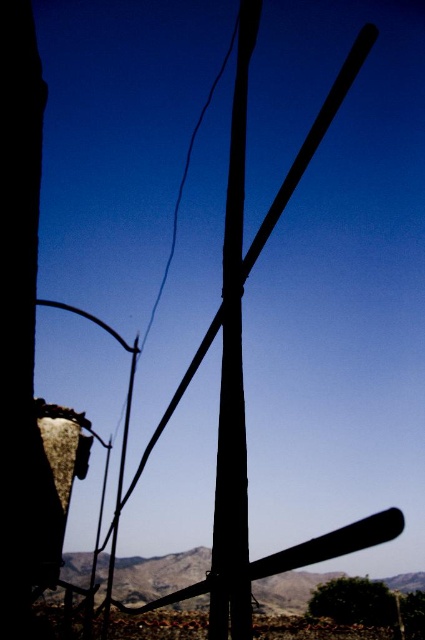
Question: Does smooth wood pole at center have a lesser width compared to green leafy tree at lower center?

Choices:
 (A) yes
 (B) no

Answer: (A)

Question: Does smooth wood pole at center lie in front of green leafy tree at lower center?

Choices:
 (A) yes
 (B) no

Answer: (A)

Question: Which object appears farthest from the camera in this image?

Choices:
 (A) smooth wood pole at center
 (B) green leafy tree at lower center

Answer: (B)

Question: Which point is farther to the camera?

Choices:
 (A) green leafy tree at lower center
 (B) smooth wood pole at center

Answer: (A)

Question: Is smooth wood pole at center wider than green leafy tree at lower center?

Choices:
 (A) yes
 (B) no

Answer: (B)